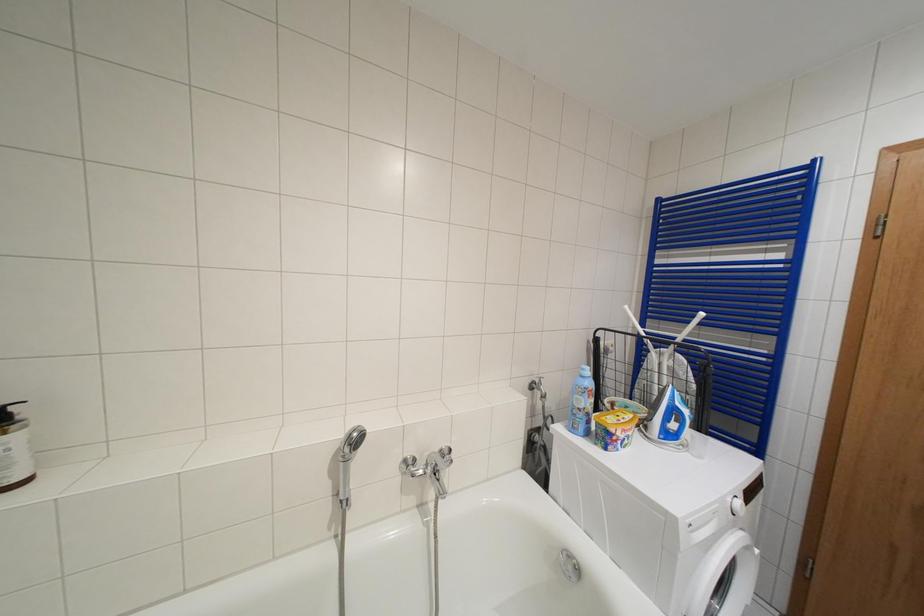
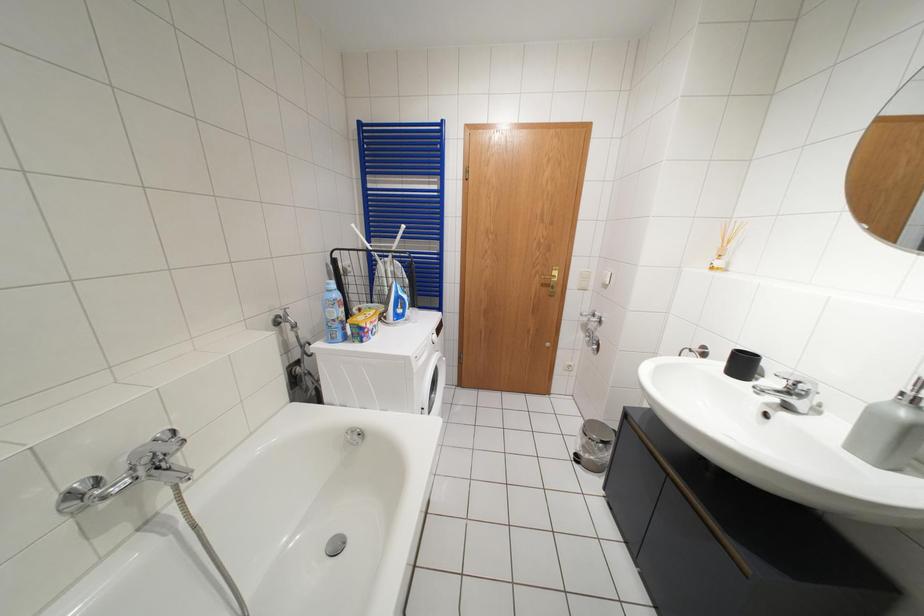
The images are taken continuously from a first-person perspective. In which direction is your viewpoint rotating?

The camera rotated toward right-down.